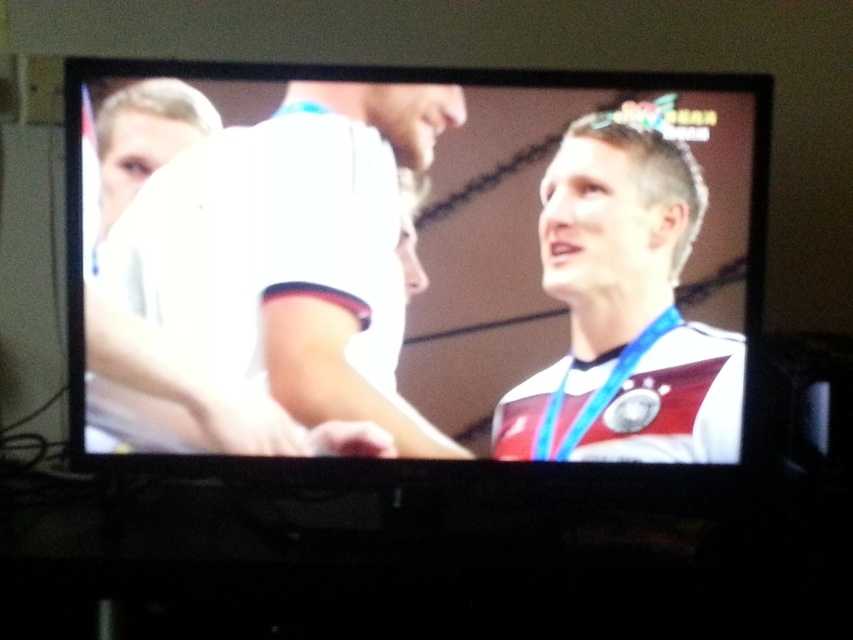
Question: Among these objects, which one is nearest to the camera?

Choices:
 (A) white fabric shirt at upper left
 (B) white fabric shirt at right
 (C) white jersey at center
 (D) white matte shirt at upper left

Answer: (C)

Question: Is white jersey at center above white fabric shirt at upper left?

Choices:
 (A) yes
 (B) no

Answer: (B)

Question: Which point is closer to the camera?

Choices:
 (A) (207, 257)
 (B) (131, 188)
 (C) (265, 412)
 (D) (672, 161)

Answer: (B)

Question: Which of the following is the farthest from the observer?

Choices:
 (A) white jersey at center
 (B) white matte shirt at upper left

Answer: (B)

Question: Does white jersey at center have a lesser width compared to white fabric shirt at upper left?

Choices:
 (A) no
 (B) yes

Answer: (A)

Question: Can you confirm if white fabric shirt at right is wider than white matte shirt at upper left?

Choices:
 (A) no
 (B) yes

Answer: (B)